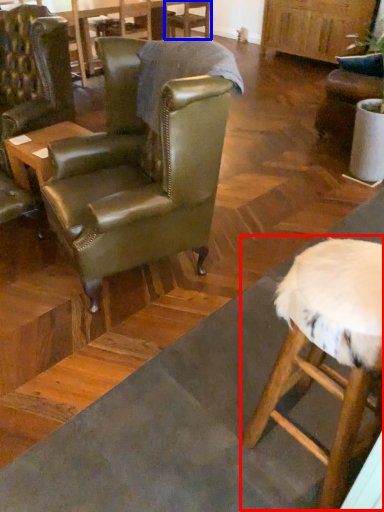
Question: Which point is further to the camera, bar stool (highlighted by a red box) or chair (highlighted by a blue box)?

Choices:
 (A) bar stool
 (B) chair

Answer: (B)